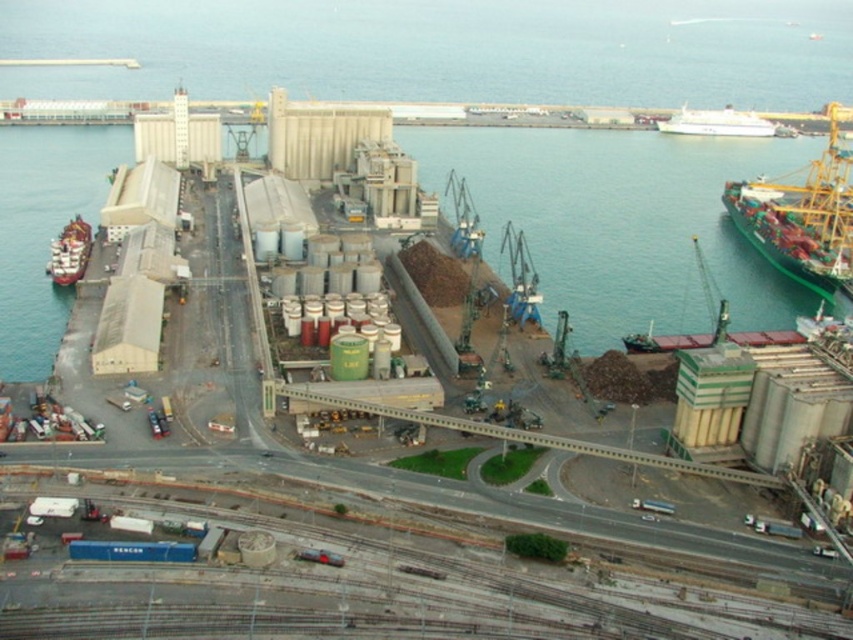
Is green matte cargo ship at upper right positioned before shiny red ship at left?

No, green matte cargo ship at upper right is further to the viewer.

Measure the distance between green matte cargo ship at upper right and shiny red ship at left.

green matte cargo ship at upper right and shiny red ship at left are 218.36 meters apart from each other.

Find the location of a particular element. The image size is (853, 640). green matte cargo ship at upper right is located at coordinates (802, 216).

Can you confirm if green metallic waterway at center is shorter than shiny red ship at left?

No, green metallic waterway at center is not shorter than shiny red ship at left.

Between point (135, 8) and point (79, 216), which one is positioned in front?

Point (79, 216) is more forward.

Where is `green metallic waterway at center`? This screenshot has width=853, height=640. green metallic waterway at center is located at coordinates (442, 49).

Can you confirm if green matte cargo ship at upper right is wider than white glossy ship at upper right?

Correct, the width of green matte cargo ship at upper right exceeds that of white glossy ship at upper right.

Who is shorter, green matte cargo ship at upper right or white glossy ship at upper right?

white glossy ship at upper right is shorter.

Between point (769, 208) and point (747, 132), which one is positioned in front?

Point (769, 208)

Find the location of a particular element. green matte cargo ship at upper right is located at coordinates (802, 216).